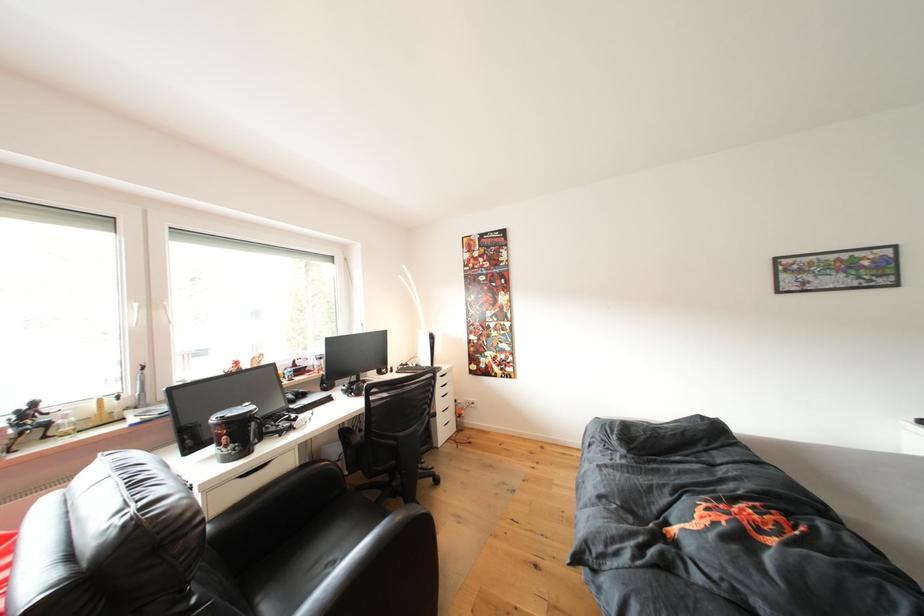
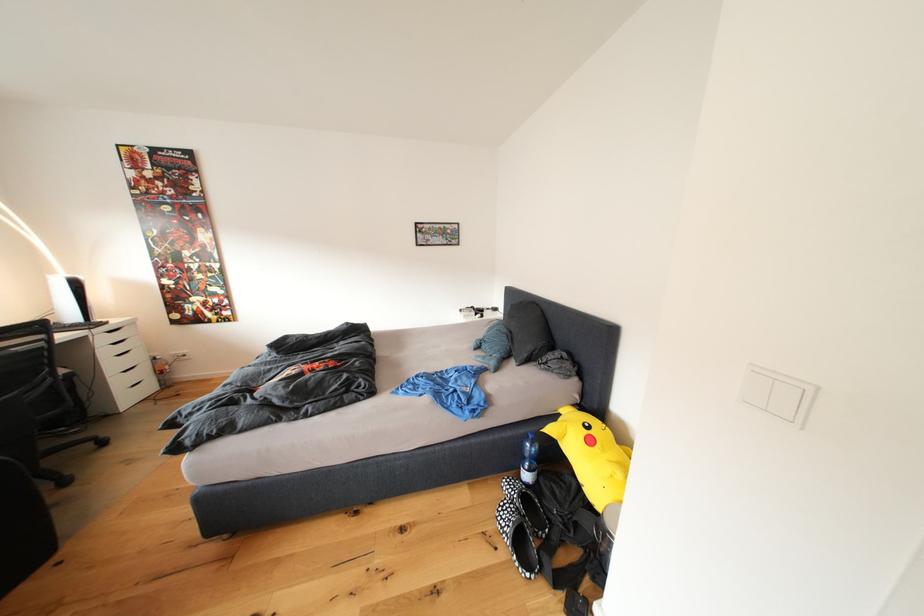
The point at (x=454, y=371) is marked in the first image. Where is the corresponding point in the second image?

(125, 326)